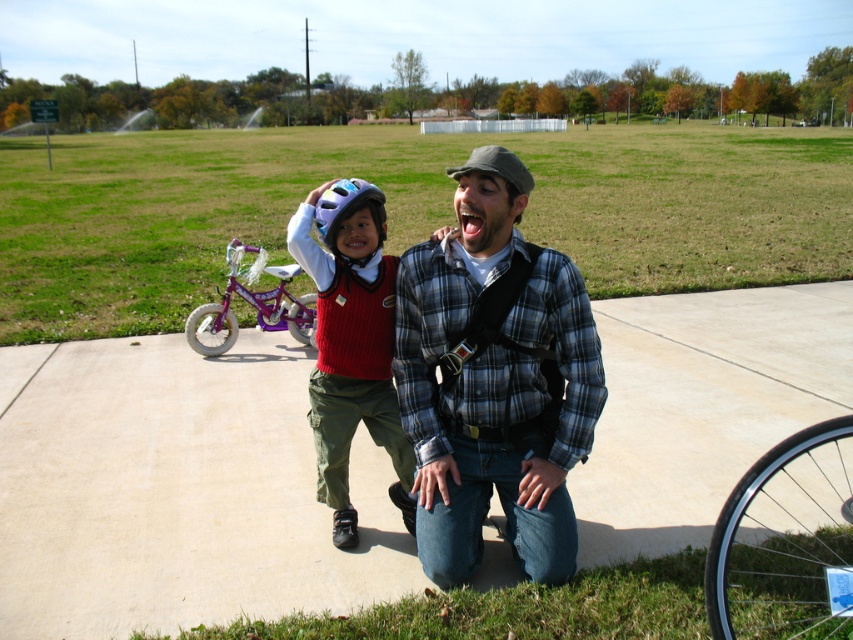
Which is below, black rubber tire at lower right or white matte bicycle helmet at center?

black rubber tire at lower right is lower down.

Does black rubber tire at lower right appear on the left side of white matte bicycle helmet at center?

In fact, black rubber tire at lower right is to the right of white matte bicycle helmet at center.

The height and width of the screenshot is (640, 853). Find the location of `black rubber tire at lower right`. black rubber tire at lower right is located at coordinates pos(786,541).

Identify the location of black rubber tire at lower right. The height and width of the screenshot is (640, 853). (786, 541).

Who is more forward, (444, 332) or (289, 307)?

Point (444, 332)

Is point (408, 300) in front of point (286, 324)?

Yes, point (408, 300) is closer to viewer.

This screenshot has width=853, height=640. In order to click on plaid flannel shirt at center in this screenshot , I will do `click(494, 380)`.

Is point (350, 442) positioned after point (274, 291)?

No, (350, 442) is in front of (274, 291).

The width and height of the screenshot is (853, 640). What do you see at coordinates (351, 342) in the screenshot?
I see `matte white helmet at center` at bounding box center [351, 342].

The height and width of the screenshot is (640, 853). What do you see at coordinates (351, 342) in the screenshot?
I see `matte white helmet at center` at bounding box center [351, 342].

Where is `matte white helmet at center`? matte white helmet at center is located at coordinates (351, 342).